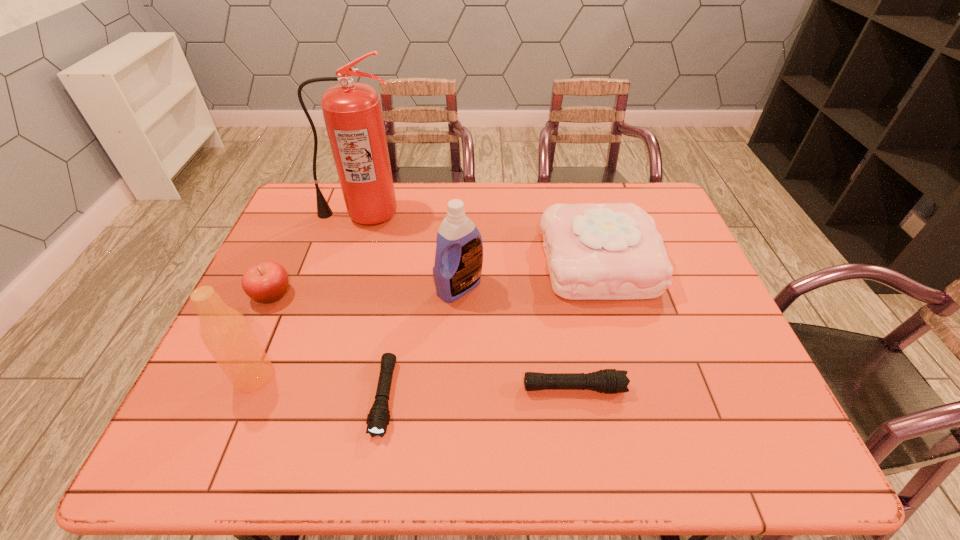
Considering the uniform spacing of flashlights, where should an additional flashlight be positioned on the right? Please locate a free spot. Please provide its 2D coordinates. Your answer should be formatted as a tuple, i.e. [(x, y)], where the tuple contains the x and y coordinates of a point satisfying the conditions above.

[(756, 379)]